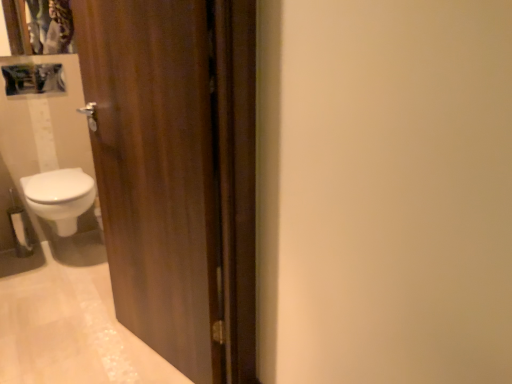
Describe the element at coordinates (177, 173) in the screenshot. I see `wooden door at left` at that location.

What is the approximate width of white matte toilet paper at lower left?

The width of white matte toilet paper at lower left is 4.28 inches.

Describe the element at coordinates (33, 79) in the screenshot. I see `matte plastic medicine cabinet at upper left` at that location.

What are the coordinates of `matte plastic medicine cabinet at upper left` in the screenshot? It's located at (33, 79).

You are a GUI agent. You are given a task and a screenshot of the screen. Output one action in this format:
    pyautogui.click(x=<x>, y=<y>)
    Task: Click on the white glossy bidet at lower left
    This screenshot has height=384, width=512.
    Given the screenshot: What is the action you would take?
    pyautogui.click(x=60, y=197)

Is white matte toilet paper at lower left to the left or to the right of matte plastic medicine cabinet at upper left in the image?

From the image, it's evident that white matte toilet paper at lower left is to the left of matte plastic medicine cabinet at upper left.

Consider the image. From a real-world perspective, between white matte toilet paper at lower left and matte plastic medicine cabinet at upper left, who is vertically lower?

white matte toilet paper at lower left.

From the image's perspective, would you say white matte toilet paper at lower left is shown under matte plastic medicine cabinet at upper left?

Yes, from the image's perspective, white matte toilet paper at lower left is below matte plastic medicine cabinet at upper left.

How different are the orientations of wooden door at left and matte plastic medicine cabinet at upper left in degrees?

They differ by 74 degrees in their facing directions.

From the image's perspective, is wooden door at left under matte plastic medicine cabinet at upper left?

Yes, from the image's perspective, wooden door at left is beneath matte plastic medicine cabinet at upper left.

Looking at this image, is matte plastic medicine cabinet at upper left surrounded by wooden door at left?

Actually, matte plastic medicine cabinet at upper left is outside wooden door at left.

In the scene shown: Is wooden door at left wider or thinner than matte plastic medicine cabinet at upper left?

Clearly, wooden door at left has less width compared to matte plastic medicine cabinet at upper left.

Is the depth of white matte toilet paper at lower left greater than that of white glossy bidet at lower left?

That is True.

In order to click on toilet paper that is under the white glossy bidet at lower left (from a real-world perspective) in this screenshot , I will do `click(20, 229)`.

Between white matte toilet paper at lower left and white glossy bidet at lower left, which one has larger width?

With larger width is white glossy bidet at lower left.

From the image's perspective, which one is positioned higher, white matte toilet paper at lower left or white glossy bidet at lower left?

white glossy bidet at lower left, from the image's perspective.

Considering the points (55, 197) and (37, 73), which point is behind, point (55, 197) or point (37, 73)?

The point (37, 73) is farther.

From the image's perspective, which one is positioned lower, white glossy bidet at lower left or matte plastic medicine cabinet at upper left?

From the image's view, white glossy bidet at lower left is below.

Is white glossy bidet at lower left oriented towards matte plastic medicine cabinet at upper left?

No, white glossy bidet at lower left is not turned towards matte plastic medicine cabinet at upper left.

Which is closer to the camera, (65, 208) or (153, 147)?

Clearly, point (65, 208) is more distant from the camera than point (153, 147).

From a real-world perspective, which object stands above the other?

In real-world perspective, wooden door at left is above.

Considering the positions of objects white glossy bidet at lower left and wooden door at left in the image provided, who is more to the right, white glossy bidet at lower left or wooden door at left?

wooden door at left.

Could you tell me if white glossy bidet at lower left is turned towards wooden door at left?

Yes.

From the image's perspective, who appears lower, white matte toilet paper at lower left or wooden door at left?

From the image's view, white matte toilet paper at lower left is below.

Is white matte toilet paper at lower left in front of or behind wooden door at left in the image?

In the image, white matte toilet paper at lower left appears behind wooden door at left.

Would you say white matte toilet paper at lower left is outside wooden door at left?

white matte toilet paper at lower left lies outside wooden door at left's area.

Based on the photo, how much distance is there between white matte toilet paper at lower left and wooden door at left?

white matte toilet paper at lower left is 5.31 feet from wooden door at left.

Which object is positioned more to the right, matte plastic medicine cabinet at upper left or white matte toilet paper at lower left?

matte plastic medicine cabinet at upper left is more to the right.

Is matte plastic medicine cabinet at upper left aimed at white matte toilet paper at lower left?

No, matte plastic medicine cabinet at upper left is not aimed at white matte toilet paper at lower left.

From the image's perspective, which is above, matte plastic medicine cabinet at upper left or white matte toilet paper at lower left?

matte plastic medicine cabinet at upper left is shown above in the image.

Is matte plastic medicine cabinet at upper left positioned far away from white matte toilet paper at lower left?

No, there isn't a large distance between matte plastic medicine cabinet at upper left and white matte toilet paper at lower left.

Find the location of a particular element. toilet paper that is behind the matte plastic medicine cabinet at upper left is located at coordinates (20, 229).

The width and height of the screenshot is (512, 384). I want to click on door that is under the matte plastic medicine cabinet at upper left (from a real-world perspective), so click(x=177, y=173).

Consider the image. Looking at the image, which one is located closer to matte plastic medicine cabinet at upper left, white glossy bidet at lower left or wooden door at left?

white glossy bidet at lower left is closer to matte plastic medicine cabinet at upper left.

Looking at the image, which one is located further to matte plastic medicine cabinet at upper left, wooden door at left or white glossy bidet at lower left?

wooden door at left is positioned further to the anchor matte plastic medicine cabinet at upper left.

Which object lies further to the anchor point white matte toilet paper at lower left, white glossy bidet at lower left or matte plastic medicine cabinet at upper left?

matte plastic medicine cabinet at upper left is positioned further to the anchor white matte toilet paper at lower left.

When comparing their distances from white glossy bidet at lower left, does white matte toilet paper at lower left or wooden door at left seem further?

wooden door at left is further to white glossy bidet at lower left.

Estimate the real-world distances between objects in this image. Which object is further from matte plastic medicine cabinet at upper left, white matte toilet paper at lower left or white glossy bidet at lower left?

white matte toilet paper at lower left is positioned further to the anchor matte plastic medicine cabinet at upper left.

Looking at the image, which one is located closer to wooden door at left, white matte toilet paper at lower left or matte plastic medicine cabinet at upper left?

The object closer to wooden door at left is matte plastic medicine cabinet at upper left.

When comparing their distances from matte plastic medicine cabinet at upper left, does wooden door at left or white matte toilet paper at lower left seem closer?

white matte toilet paper at lower left lies closer to matte plastic medicine cabinet at upper left than the other object.

Based on their spatial positions, is matte plastic medicine cabinet at upper left or wooden door at left closer to white matte toilet paper at lower left?

matte plastic medicine cabinet at upper left is positioned closer to the anchor white matte toilet paper at lower left.

Find the location of `bidet that lies between matte plastic medicine cabinet at upper left and white matte toilet paper at lower left from top to bottom`. bidet that lies between matte plastic medicine cabinet at upper left and white matte toilet paper at lower left from top to bottom is located at coordinates (60, 197).

The image size is (512, 384). Identify the location of bidet located between wooden door at left and matte plastic medicine cabinet at upper left in the depth direction. (60, 197).

You are a GUI agent. You are given a task and a screenshot of the screen. Output one action in this format:
    pyautogui.click(x=<x>, y=<y>)
    Task: Click on the bidet between wooden door at left and white matte toilet paper at lower left along the z-axis
    The height and width of the screenshot is (384, 512).
    Given the screenshot: What is the action you would take?
    pyautogui.click(x=60, y=197)

Locate an element on the screen. medicine cabinet between wooden door at left and white matte toilet paper at lower left along the z-axis is located at coordinates (33, 79).